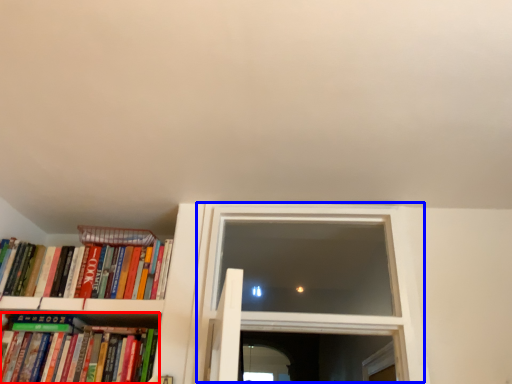
Question: Among these objects, which one is nearest to the camera, book (highlighted by a red box) or window (highlighted by a blue box)?

Choices:
 (A) book
 (B) window

Answer: (A)